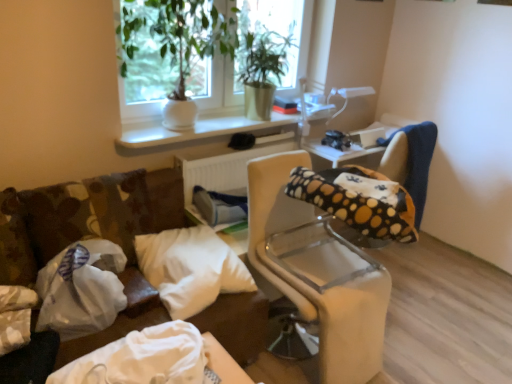
Question: Could you tell me if white plastic radiator at center is turned towards green leafy plant at upper center?

Choices:
 (A) no
 (B) yes

Answer: (A)

Question: Does white plastic radiator at center lie in front of green leafy plant at upper center?

Choices:
 (A) no
 (B) yes

Answer: (A)

Question: Is white plastic radiator at center completely or partially outside of green leafy plant at upper center?

Choices:
 (A) no
 (B) yes

Answer: (B)

Question: From a real-world perspective, is white plastic radiator at center below green leafy plant at upper center?

Choices:
 (A) yes
 (B) no

Answer: (A)

Question: Is white plastic radiator at center smaller than green leafy plant at upper center?

Choices:
 (A) no
 (B) yes

Answer: (B)

Question: Can you confirm if white plastic radiator at center is taller than green leafy plant at upper center?

Choices:
 (A) no
 (B) yes

Answer: (A)

Question: Considering the relative positions of green leafy plant at upper center and white soft pillow at center in the image provided, is green leafy plant at upper center to the left of white soft pillow at center from the viewer's perspective?

Choices:
 (A) yes
 (B) no

Answer: (A)

Question: Does green leafy plant at upper center have a lesser height compared to white soft pillow at center?

Choices:
 (A) yes
 (B) no

Answer: (B)

Question: From a real-world perspective, is green leafy plant at upper center physically above white soft pillow at center?

Choices:
 (A) no
 (B) yes

Answer: (B)

Question: Does green leafy plant at upper center have a greater width compared to white soft pillow at center?

Choices:
 (A) no
 (B) yes

Answer: (A)

Question: Does green leafy plant at upper center have a larger size compared to white soft pillow at center?

Choices:
 (A) yes
 (B) no

Answer: (A)

Question: Is green leafy plant at upper center thinner than white soft pillow at center?

Choices:
 (A) yes
 (B) no

Answer: (A)

Question: Would you consider white plastic radiator at center to be distant from polka dot fabric bean bag chair at right?

Choices:
 (A) yes
 (B) no

Answer: (B)